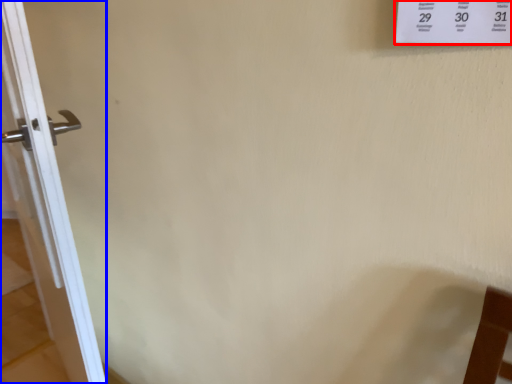
Question: Which point is further to the camera, poster (highlighted by a red box) or door (highlighted by a blue box)?

Choices:
 (A) poster
 (B) door

Answer: (B)